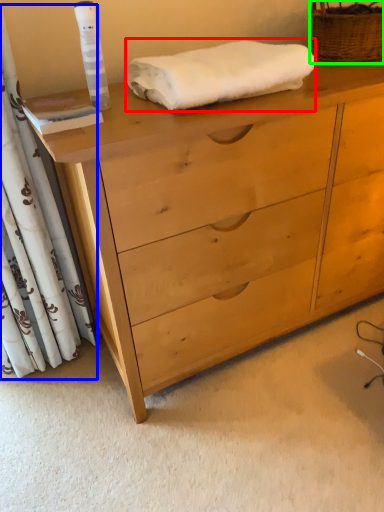
Question: Which object is the farthest from bath towel (highlighted by a red box)? Choose among these: curtain (highlighted by a blue box) or basket (highlighted by a green box).

Choices:
 (A) curtain
 (B) basket

Answer: (A)